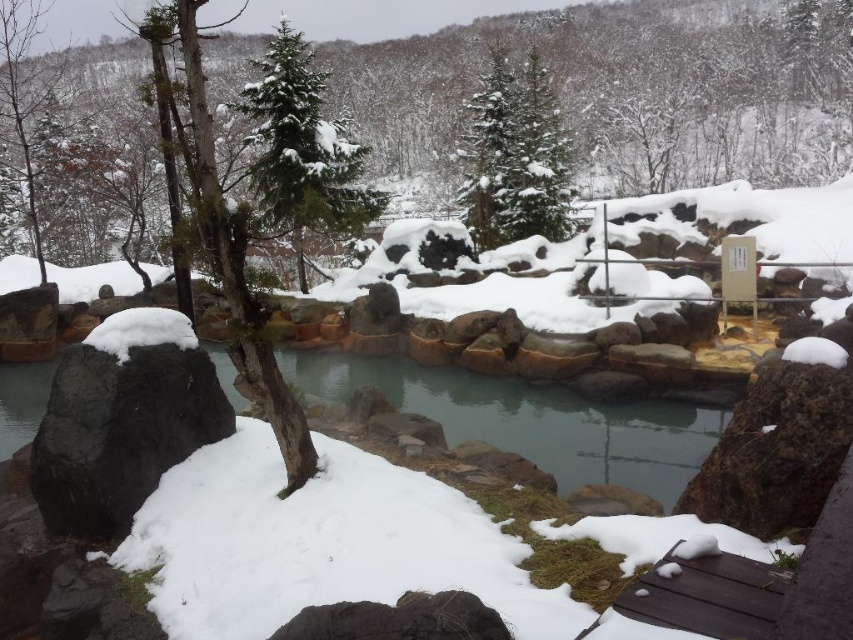
You are standing on the wooden walkway leading to the onsen. You see the clear water at center and the green textured pine tree at upper center. Which object is located to the right of the other?

The clear water at center is to the right of the green textured pine tree at upper center.

You are a visitor at the onsen and want to take a photo of the clear water at center and the green textured pine tree at upper center. Which object is closer to the camera? Please explain based on their positions.

The clear water at center is positioned under the green textured pine tree at upper center, so the green textured pine tree at upper center is closer to the camera since it is above the water.

You are standing on the wooden walkway and want to take a photo of the clear water at center and the green textured evergreen tree at upper center. Which object should you focus on first to ensure both are in the frame?

You should focus on the clear water at center first because it is to the left of the green textured evergreen tree at upper center, so positioning your camera to include both would require starting with the leftmost object.